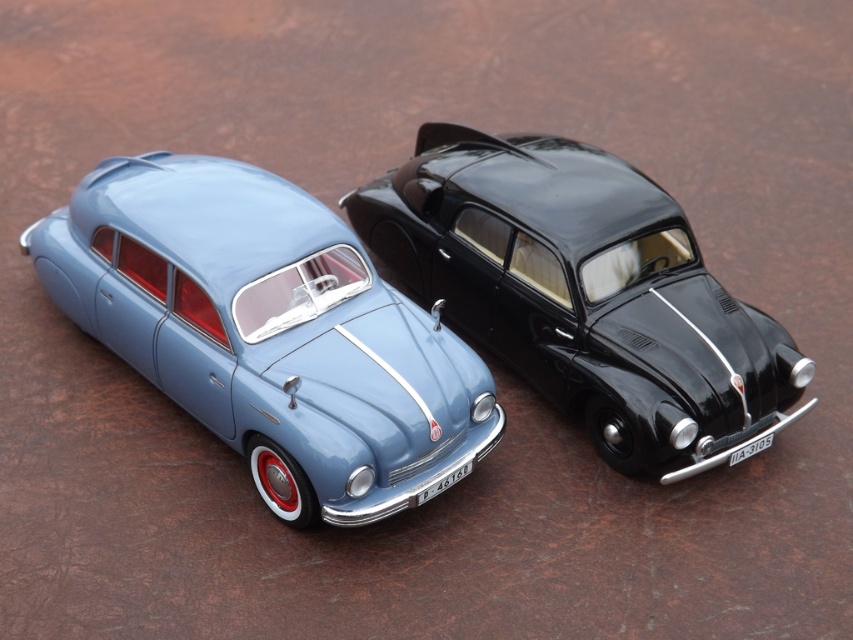
You are a delivery robot that needs to pass through a narrow corridor that can only accommodate cars with a width of 1.2 meters. You have to decide whether the matte blue car at center or the shiny black car at center can fit through. Which car is more likely to fit through the corridor?

The matte blue car at center might be wider than the shiny black car at center, so the shiny black car at center is more likely to fit through the corridor since it is narrower.

You are a collector who wants to arrange your miniature cars in a straight line from left to right. You have the matte blue car at center and the shiny black car at center. Based on their current positions, which car should you place first on the left side of the line?

The matte blue car at center should be placed first on the left side of the line because it is currently positioned to the left of the shiny black car at center.

Based on the photo, you are standing in front of two vintage model cars displayed on a stone floor. You notice a specific point marked at coordinates point (207, 260). Considering your current position, can you estimate how far this point is from you?

The point (207, 260) is 8.97 feet away from the camera, so it is approximately 8.97 feet away from your current position.